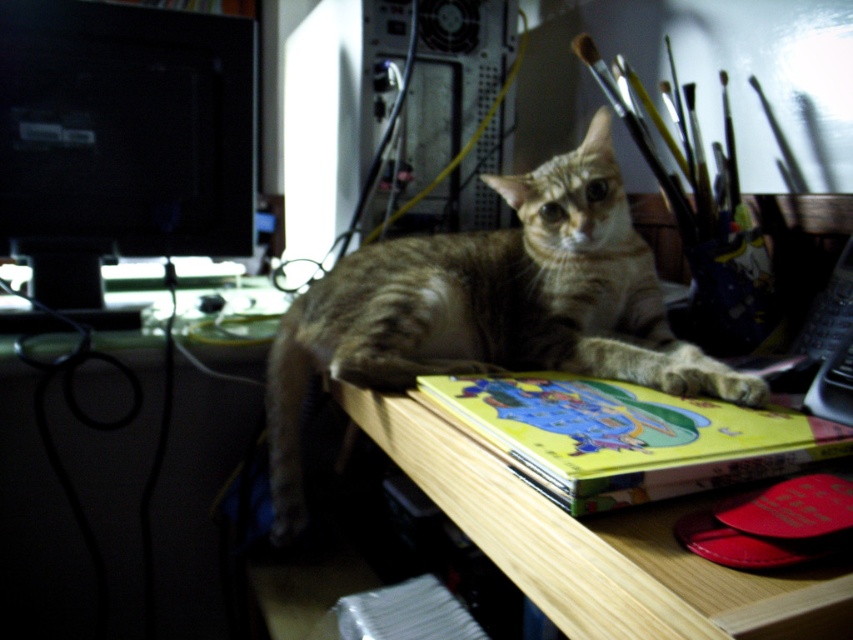
Is tabby fur cat at center wider than matte plastic computer desk at lower left?

Yes.

Does point (732, 388) come in front of point (67, 538)?

Yes, it is.

Which is in front, point (329, 317) or point (155, 413)?

Point (329, 317)

You are a GUI agent. You are given a task and a screenshot of the screen. Output one action in this format:
    pyautogui.click(x=<x>, y=<y>)
    Task: Click on the tabby fur cat at center
    This screenshot has height=640, width=853.
    Given the screenshot: What is the action you would take?
    pyautogui.click(x=490, y=308)

Which of these two, tabby fur cat at center or black glossy monitor at left, stands shorter?

black glossy monitor at left is shorter.

This screenshot has height=640, width=853. What do you see at coordinates (490, 308) in the screenshot?
I see `tabby fur cat at center` at bounding box center [490, 308].

Where is `tabby fur cat at center`? tabby fur cat at center is located at coordinates (490, 308).

Based on the photo, which is above, black glossy monitor at left or yellow matte book at center?

black glossy monitor at left is higher up.

Can you confirm if black glossy monitor at left is positioned below yellow matte book at center?

No.

What do you see at coordinates (120, 138) in the screenshot? I see `black glossy monitor at left` at bounding box center [120, 138].

You are a GUI agent. You are given a task and a screenshot of the screen. Output one action in this format:
    pyautogui.click(x=<x>, y=<y>)
    Task: Click on the black glossy monitor at left
    
    Given the screenshot: What is the action you would take?
    pyautogui.click(x=120, y=138)